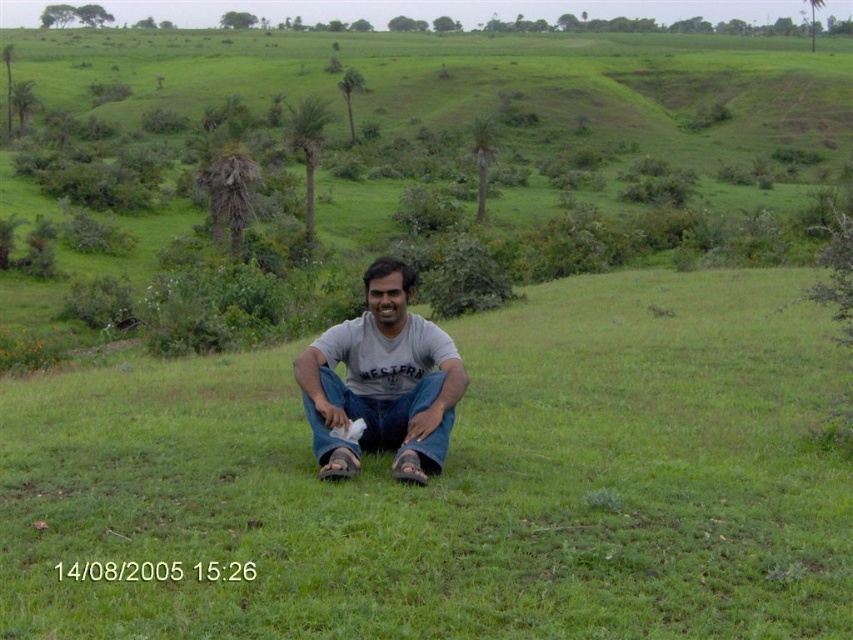
Who is higher up, green grassy at center or gray cotton shirt at center?

gray cotton shirt at center is above.

Can you confirm if green grassy at center is wider than gray cotton shirt at center?

Indeed, green grassy at center has a greater width compared to gray cotton shirt at center.

Is point (55, 499) positioned in front of point (450, 401)?

Yes.

Where is `green grassy at center`? green grassy at center is located at coordinates (459, 483).

Is point (265, 396) farther from camera compared to point (312, 433)?

Yes, point (265, 396) is farther from viewer.

Which is behind, point (618, 369) or point (387, 444)?

The point (618, 369) is behind.

Locate an element on the screen. This screenshot has width=853, height=640. green grassy at center is located at coordinates (459, 483).

How distant is gray cotton shirt at center from jeans at center?

A distance of 15.83 inches exists between gray cotton shirt at center and jeans at center.

Between gray cotton shirt at center and jeans at center, which one has less height?

gray cotton shirt at center

Who is more distant from viewer, [376,404] or [428,470]?

The point [376,404] is more distant.

Where is `gray cotton shirt at center`? This screenshot has height=640, width=853. gray cotton shirt at center is located at coordinates 381,381.